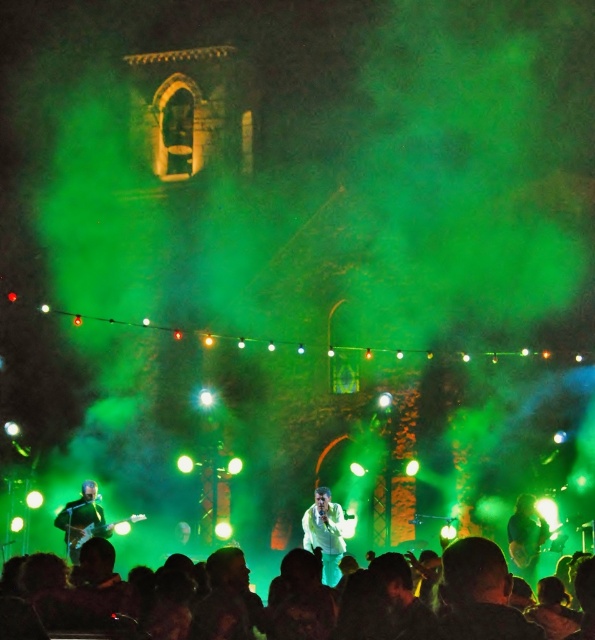
Between point (418, 609) and point (305, 541), which one is positioned behind?

The point (305, 541) is more distant.

Can you confirm if silhouette crowd at lower center is taller than white glossy shirt at center?

Correct, silhouette crowd at lower center is much taller as white glossy shirt at center.

Is point (389, 600) farther from viewer compared to point (328, 548)?

That is False.

You are a GUI agent. You are given a task and a screenshot of the screen. Output one action in this format:
    pyautogui.click(x=<x>, y=<y>)
    Task: Click on the silhouette crowd at lower center
    The image size is (595, 640).
    Given the screenshot: What is the action you would take?
    pyautogui.click(x=424, y=605)

Does white glossy shirt at center have a lesser width compared to green fabric shirt at center?

Incorrect, white glossy shirt at center's width is not less than green fabric shirt at center's.

Which of these two, white glossy shirt at center or green fabric shirt at center, stands taller?

Standing taller between the two is white glossy shirt at center.

Which is in front, point (333, 509) or point (515, 520)?

Point (515, 520) is more forward.

At what (x,y) coordinates should I click in order to perform the action: click on white glossy shirt at center. Please return your answer as a coordinate pair (x, y). Looking at the image, I should click on (324, 532).

Does point (330, 570) lie behind point (82, 520)?

No, (330, 570) is in front of (82, 520).

Where is `white glossy shirt at center`? This screenshot has height=640, width=595. white glossy shirt at center is located at coordinates (324, 532).